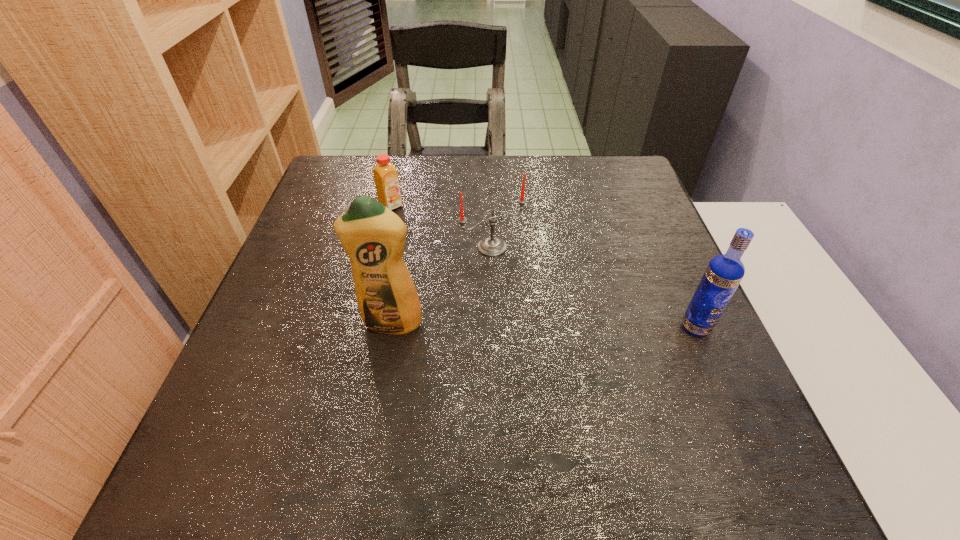
The height and width of the screenshot is (540, 960). I want to click on vacant space at the right edge of the desktop, so click(668, 246).

The width and height of the screenshot is (960, 540). In the image, there is a desktop. In order to click on blank space at the far left corner in this screenshot , I will do `click(331, 185)`.

I want to click on vacant area that lies between the vodka and the shortest object, so click(543, 266).

At what (x,y) coordinates should I click in order to perform the action: click on free space between the tallest object and the second object from right to left. Please return your answer as a coordinate pair (x, y). The width and height of the screenshot is (960, 540). Looking at the image, I should click on (442, 285).

Identify the location of vacant point located between the candle and the rightmost object. This screenshot has width=960, height=540. (594, 287).

At what (x,y) coordinates should I click in order to perform the action: click on vacant space that is in between the candle and the tallest object. Please return your answer as a coordinate pair (x, y). This screenshot has width=960, height=540. Looking at the image, I should click on 442,285.

I want to click on vacant region between the tallest object and the third shortest object, so click(x=543, y=326).

Locate an element on the screen. The width and height of the screenshot is (960, 540). vacant space that's between the second tallest object and the second object from right to left is located at coordinates (594, 287).

You are a GUI agent. You are given a task and a screenshot of the screen. Output one action in this format:
    pyautogui.click(x=<x>, y=<y>)
    Task: Click on the vacant space in between the shortest object and the vodka
    The height and width of the screenshot is (540, 960).
    Given the screenshot: What is the action you would take?
    pyautogui.click(x=543, y=266)

Identify the location of blank region between the rightmost object and the second object from right to left. (594, 287).